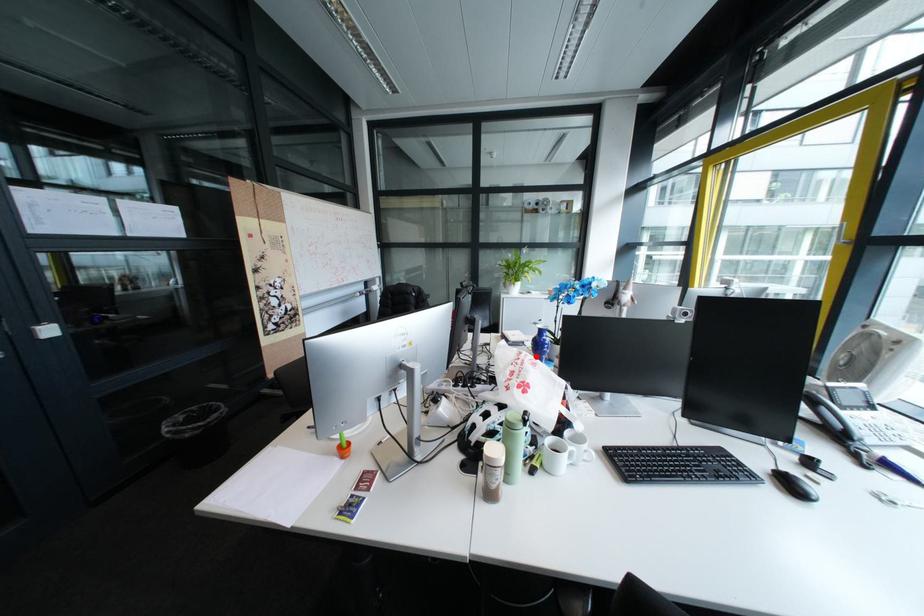
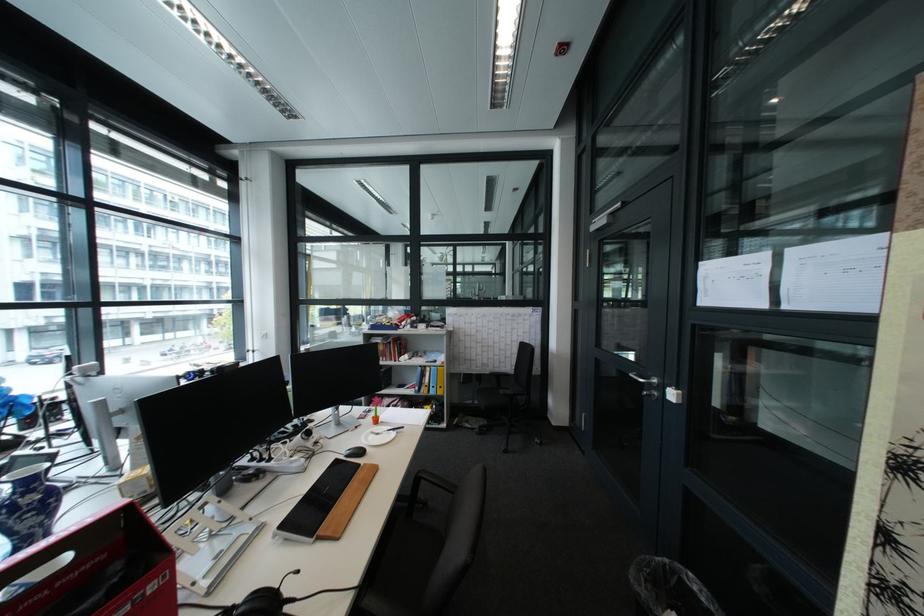
Question: I am providing you with two images of the same scene from different viewpoints. A red point is marked on the first image. Is the red point's position out of view in image 2?

Choices:
 (A) Yes
 (B) No

Answer: (A)